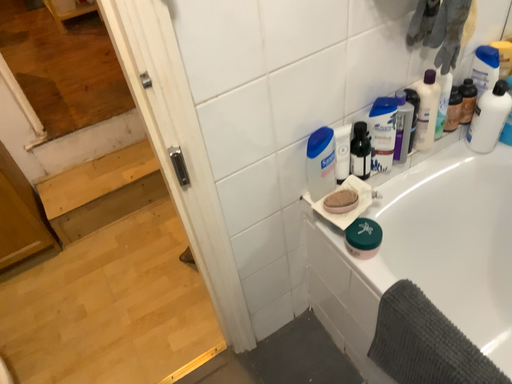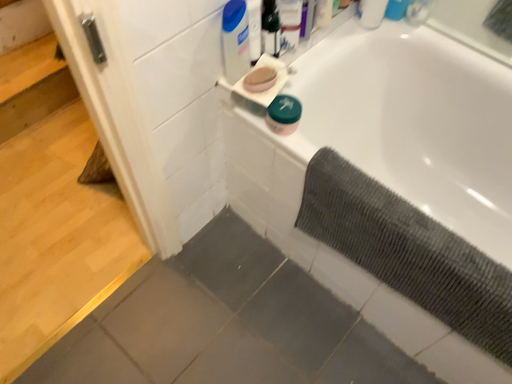
Question: Which way did the camera rotate in the video?

Choices:
 (A) rotated left
 (B) rotated right

Answer: (B)